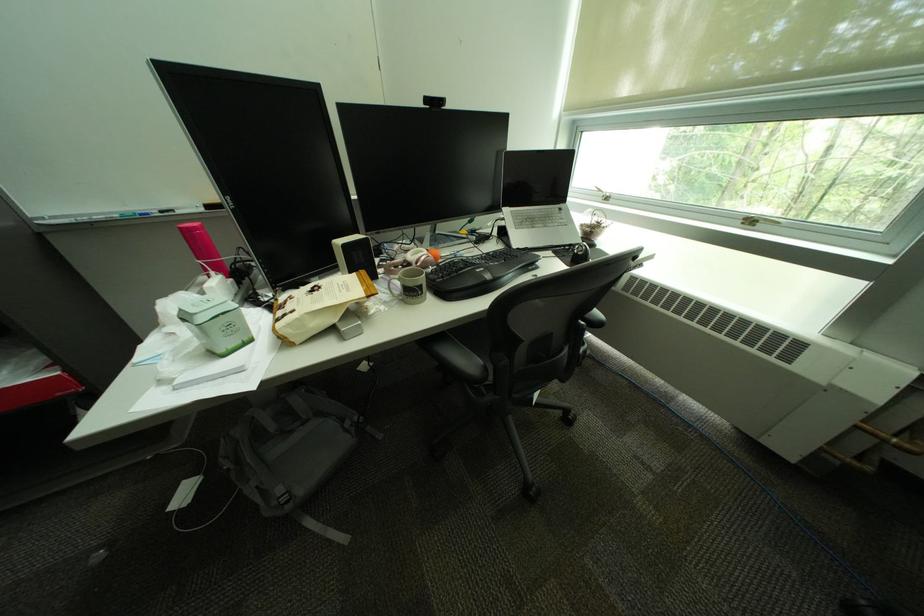
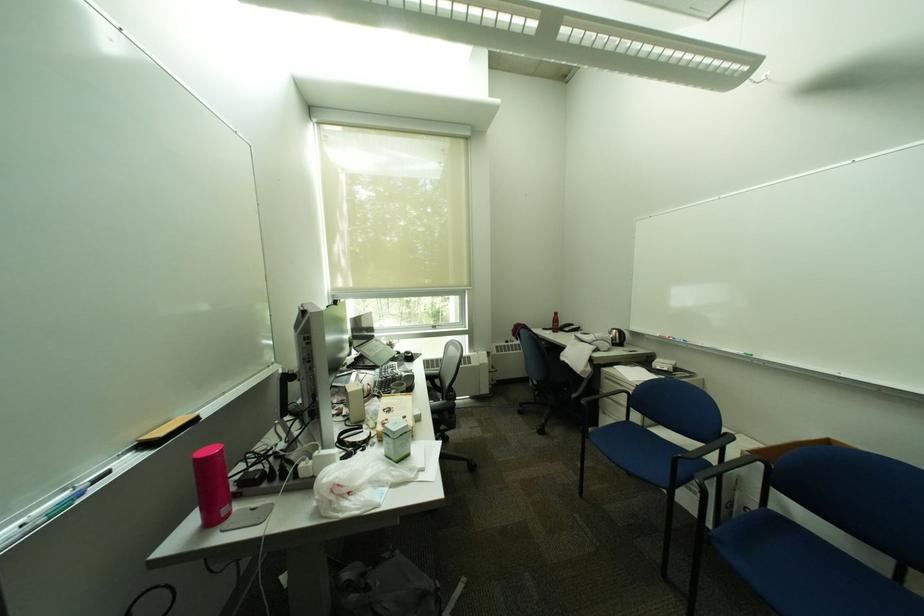
Find the pixel in the second image that matches pixel 357 431 in the first image.

(400, 560)